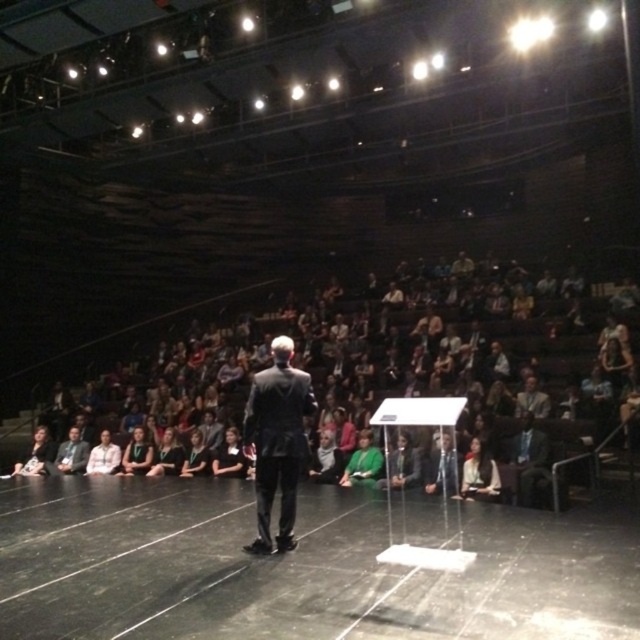
Is dark gray suit at lower left wider than white shirt at center?

Correct, the width of dark gray suit at lower left exceeds that of white shirt at center.

Is point (29, 452) positioned behind point (96, 461)?

Yes.

In order to click on dark gray suit at lower left in this screenshot , I will do `click(35, 454)`.

Between dark green fabric seats at center and matte black suit at center, which one appears on the left side from the viewer's perspective?

matte black suit at center

Consider the image. Does dark green fabric seats at center have a lesser width compared to matte black suit at center?

Incorrect, dark green fabric seats at center's width is not less than matte black suit at center's.

Who is more distant from viewer, (595, 371) or (266, 429)?

Positioned behind is point (595, 371).

Where is `dark green fabric seats at center`? dark green fabric seats at center is located at coordinates (401, 381).

Does matte black suit at center appear under dark gray suit at lower left?

Actually, matte black suit at center is above dark gray suit at lower left.

Does point (253, 429) come behind point (28, 461)?

No, (253, 429) is in front of (28, 461).

You are a GUI agent. You are given a task and a screenshot of the screen. Output one action in this format:
    pyautogui.click(x=<x>, y=<y>)
    Task: Click on the matte black suit at center
    This screenshot has height=640, width=640.
    Given the screenshot: What is the action you would take?
    pyautogui.click(x=276, y=442)